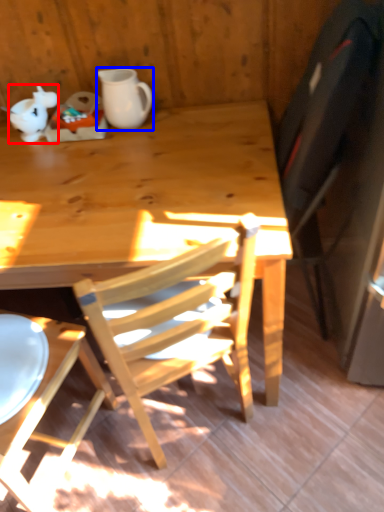
Question: Which of the following is the farthest to the observer, teapot (highlighted by a red box) or coffee cup (highlighted by a blue box)?

Choices:
 (A) teapot
 (B) coffee cup

Answer: (A)